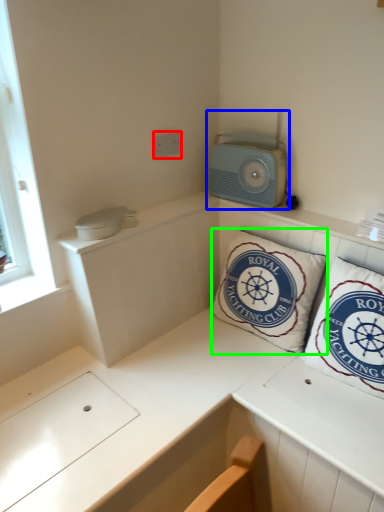
Question: Considering the real-world distances, which object is closest to electric outlet (highlighted by a red box)? appliance (highlighted by a blue box) or pillow (highlighted by a green box).

Choices:
 (A) appliance
 (B) pillow

Answer: (A)